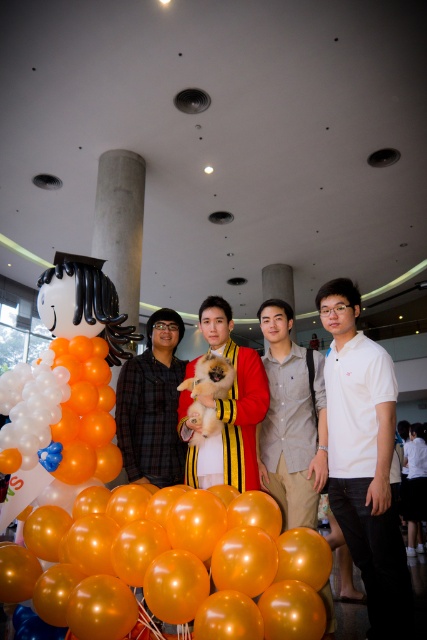
Where is `orange matte balloons at center`? Image resolution: width=427 pixels, height=640 pixels. orange matte balloons at center is located at coordinates (64, 387).

Which is below, orange matte balloons at center or concrete pillar at center?

orange matte balloons at center is lower down.

What do you see at coordinates (64, 387) in the screenshot? The width and height of the screenshot is (427, 640). I see `orange matte balloons at center` at bounding box center [64, 387].

Image resolution: width=427 pixels, height=640 pixels. Identify the location of orange matte balloons at center. 64,387.

Is velvet-like red scarf at center closer to camera compared to concrete pillar at center?

Yes, it is in front of concrete pillar at center.

Based on the photo, is velvet-like red scarf at center above concrete pillar at center?

Incorrect, velvet-like red scarf at center is not positioned above concrete pillar at center.

This screenshot has height=640, width=427. What do you see at coordinates (231, 406) in the screenshot?
I see `velvet-like red scarf at center` at bounding box center [231, 406].

Locate an element on the screen. The width and height of the screenshot is (427, 640). velvet-like red scarf at center is located at coordinates (231, 406).

Which is in front, point (383, 616) or point (287, 307)?

Point (383, 616) is in front.

Does point (327, 369) come farther from viewer compared to point (306, 456)?

That is True.

At what (x,y) coordinates should I click in order to perform the action: click on white cotton polo shirt at right. Please return your answer as a coordinate pair (x, y). Looking at the image, I should click on (365, 460).